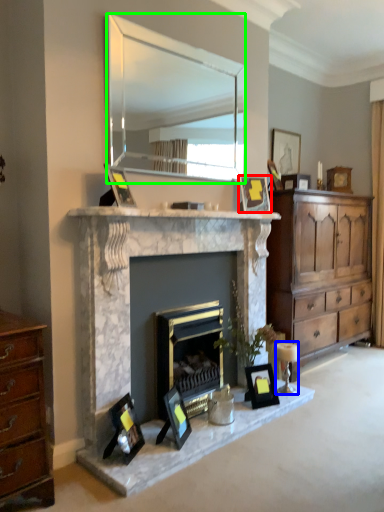
Question: Which is farther away from picture frame (highlighted by a red box)? candle holder (highlighted by a blue box) or mirror (highlighted by a green box)?

Choices:
 (A) candle holder
 (B) mirror

Answer: (B)